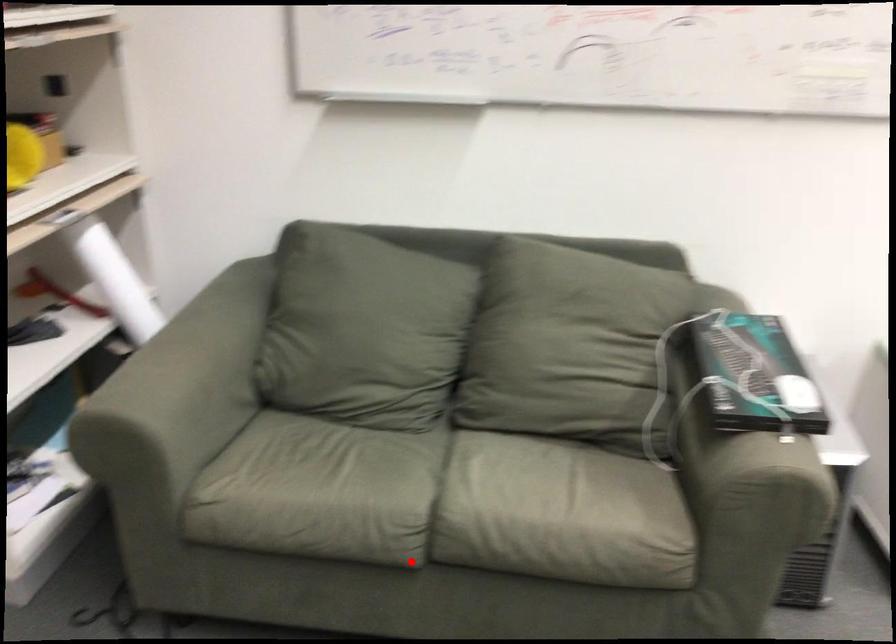
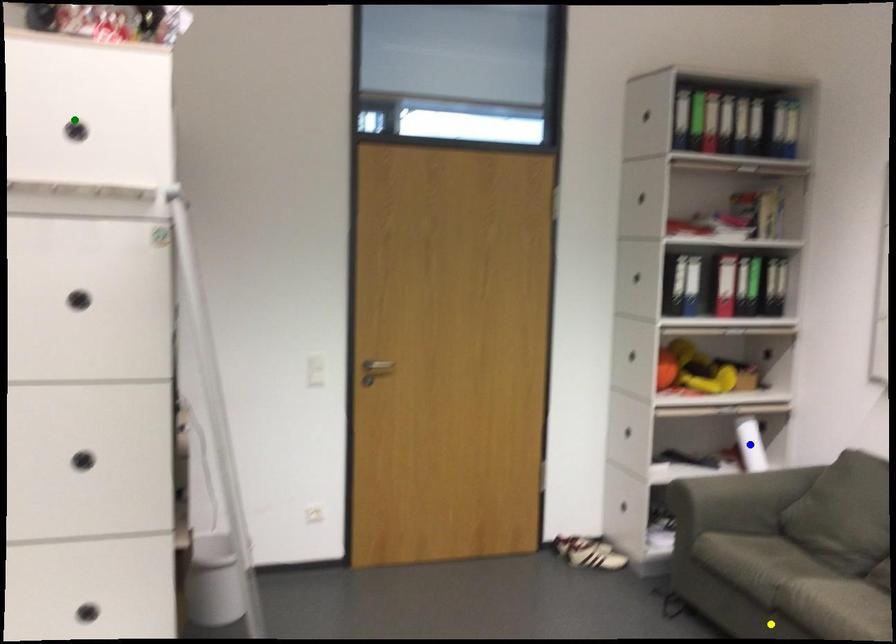
Question: I am providing you with two images of the same scene from different viewpoints. A red point is marked on the first image. You are given multiple points on the second image. Which spot in image 2 lines up with the point in image 1?

Choices:
 (A) yellow point
 (B) green point
 (C) blue point

Answer: (A)